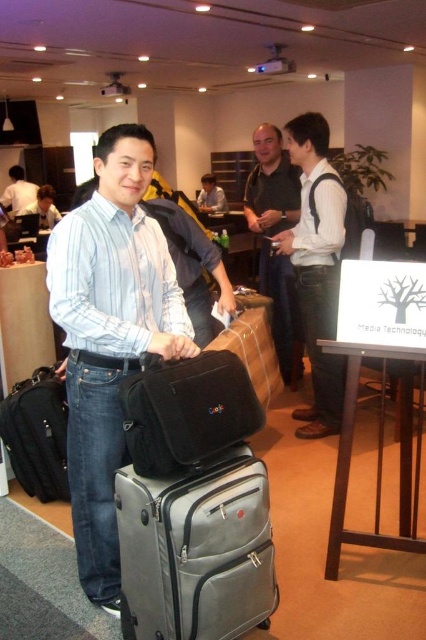
Does matte blue shirt at center lie behind dark gray shirt at center?

That is False.

Between matte blue shirt at center and dark gray shirt at center, which one appears on the right side from the viewer's perspective?

From the viewer's perspective, dark gray shirt at center appears more on the right side.

The width and height of the screenshot is (426, 640). Describe the element at coordinates (109, 336) in the screenshot. I see `matte blue shirt at center` at that location.

The width and height of the screenshot is (426, 640). Find the location of `matte blue shirt at center`. matte blue shirt at center is located at coordinates (109, 336).

Which is behind, point (72, 362) or point (198, 388)?

The point (72, 362) is behind.

Does matte blue shirt at center have a lesser width compared to black fabric bag at center?

No.

Measure the distance between matte blue shirt at center and camera.

A distance of 1.55 meters exists between matte blue shirt at center and camera.

Locate an element on the screen. The width and height of the screenshot is (426, 640). matte blue shirt at center is located at coordinates (109, 336).

Is gray fabric suitcase at center further to the viewer compared to white matte shirt at upper left?

That is False.

Which is below, gray fabric suitcase at center or white matte shirt at upper left?

gray fabric suitcase at center is below.

Is point (132, 561) positioned before point (31, 184)?

Yes.

In order to click on gray fabric suitcase at center in this screenshot , I will do `click(196, 552)`.